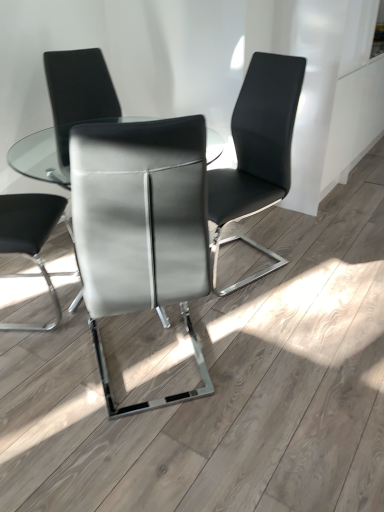
This screenshot has width=384, height=512. I want to click on free spot in front of satin gray leather chair at center, placed as the 2th chair when sorted from left to right, so click(143, 450).